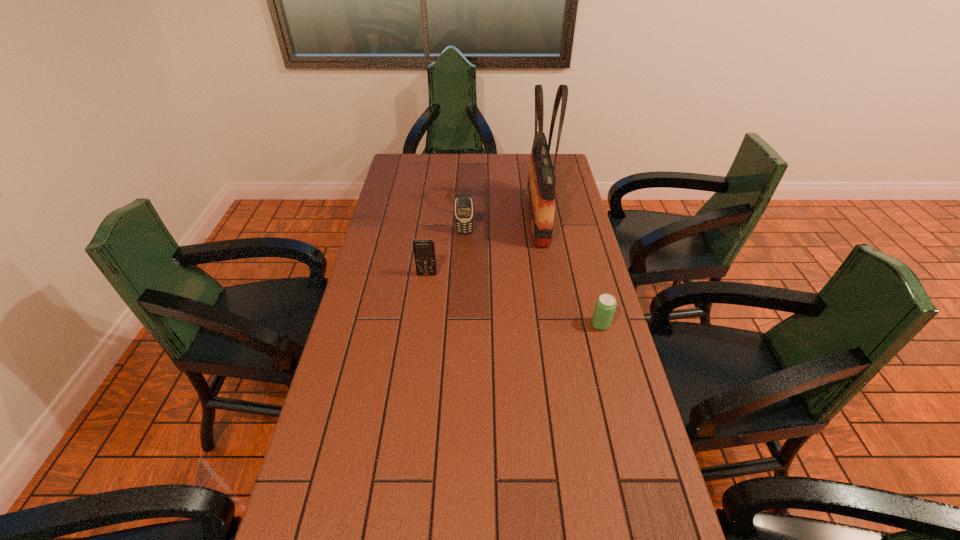
Locate an element on the screen. shopping bag is located at coordinates (541, 187).

Locate an element on the screen. This screenshot has height=540, width=960. the tallest object is located at coordinates (541, 187).

I want to click on the second object from left to right, so click(x=464, y=209).

Find the location of `the right cellular telephone`. the right cellular telephone is located at coordinates (464, 209).

Image resolution: width=960 pixels, height=540 pixels. What are the coordinates of `the second nearest object` in the screenshot? It's located at (424, 250).

Where is `the leftmost object`? This screenshot has width=960, height=540. the leftmost object is located at coordinates (424, 250).

The image size is (960, 540). What are the coordinates of `the shortest object` in the screenshot? It's located at (605, 306).

Locate an element on the screen. Image resolution: width=960 pixels, height=540 pixels. soda is located at coordinates (605, 306).

The image size is (960, 540). I want to click on free region located on the front-facing side of the shopping bag, so click(x=443, y=218).

Identify the location of vacant position located on the front-facing side of the shopping bag. [484, 218].